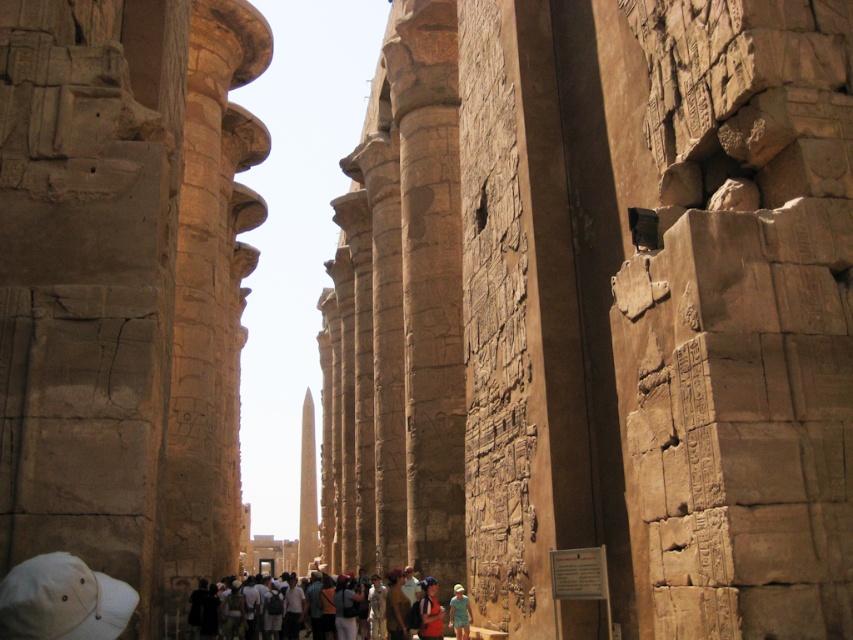
Question: Based on their relative distances, which object is farther from the beige stone column at left?

Choices:
 (A) green fabric dress at center
 (B) light brown fabric backpack at center

Answer: (A)

Question: Does beige stone column at left appear on the left side of light brown fabric backpack at center?

Choices:
 (A) no
 (B) yes

Answer: (B)

Question: Can you confirm if beige stone column at left is positioned above green fabric dress at center?

Choices:
 (A) yes
 (B) no

Answer: (A)

Question: Does beige stone wall at center appear under beige stone column at left?

Choices:
 (A) yes
 (B) no

Answer: (A)

Question: Which point is closer to the camera taking this photo?

Choices:
 (A) (456, 589)
 (B) (643, 465)
 (C) (103, 563)
 (D) (474, 637)

Answer: (C)

Question: Which object is closer to the camera taking this photo?

Choices:
 (A) beige stone wall at center
 (B) light brown fabric backpack at center
 (C) green fabric dress at center

Answer: (A)